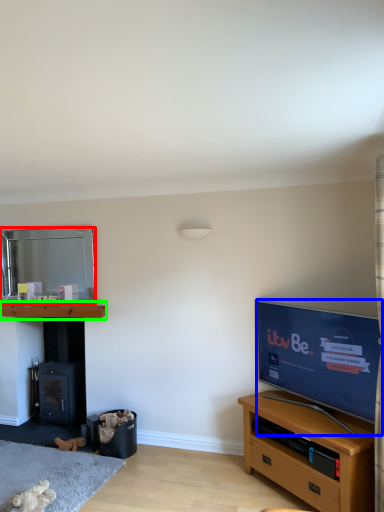
Question: Based on their relative distances, which object is farther from mirror (highlighted by a red box)? Choose from television (highlighted by a blue box) and shelf (highlighted by a green box).

Choices:
 (A) television
 (B) shelf

Answer: (A)